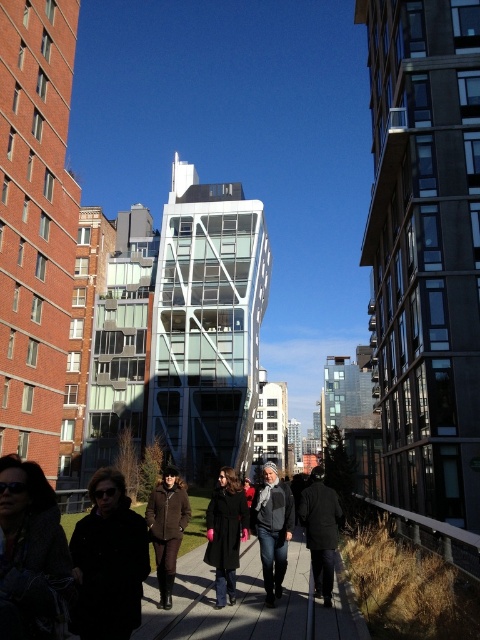
Does point (240, 636) come closer to viewer compared to point (242, 493)?

That is True.

Does wooden walkway at center appear on the left side of black wool coat at center?

Incorrect, wooden walkway at center is not on the left side of black wool coat at center.

Who is more distant from viewer, (x=143, y=608) or (x=229, y=536)?

The point (x=229, y=536) is more distant.

This screenshot has width=480, height=640. What are the coordinates of `wooden walkway at center` in the screenshot? It's located at (249, 604).

Which is in front, point (116, 621) or point (275, 573)?

Point (116, 621) is more forward.

In the scene shown: Is black wool coat at lower left wider than dark gray knit scarf at center?

In fact, black wool coat at lower left might be narrower than dark gray knit scarf at center.

Find the location of a particular element. Image resolution: width=480 pixels, height=640 pixels. black wool coat at lower left is located at coordinates click(108, 561).

You are a GUI agent. You are given a task and a screenshot of the screen. Output one action in this format:
    pyautogui.click(x=<x>, y=<y>)
    Task: Click on the black wool coat at lower left
    The image size is (480, 640).
    Given the screenshot: What is the action you would take?
    pyautogui.click(x=108, y=561)

Between dark gray knit scarf at center and dark gray wool coat at center, which one has more height?

dark gray knit scarf at center

Between point (286, 528) and point (310, 541), which one is positioned in front?

Positioned in front is point (286, 528).

Who is more forward, (265, 560) or (320, 538)?

Point (265, 560) is in front.

I want to click on dark gray knit scarf at center, so click(x=273, y=529).